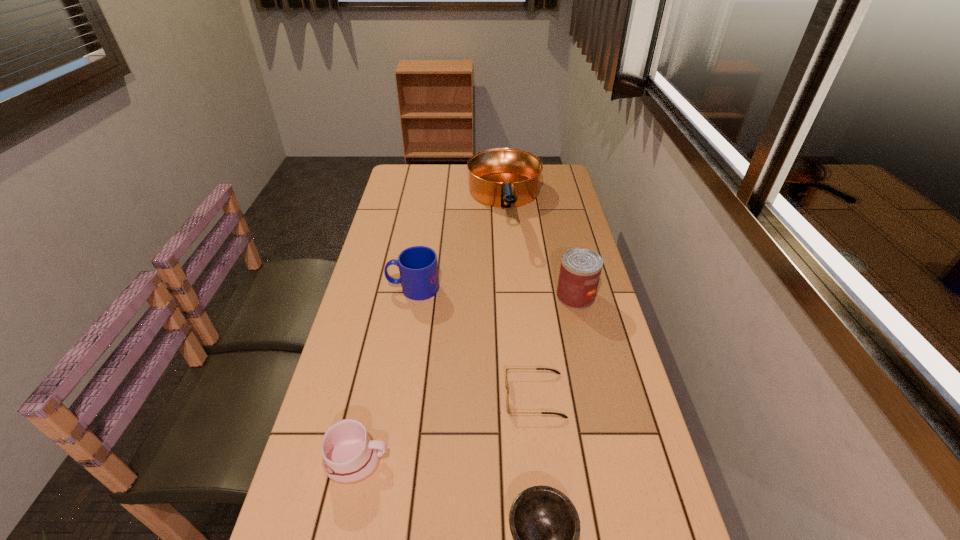
The height and width of the screenshot is (540, 960). I want to click on the farthest object, so click(501, 177).

At what (x,y) coordinates should I click in order to perform the action: click on frying pan. Please return your answer as a coordinate pair (x, y). Looking at the image, I should click on (501, 177).

At what (x,y) coordinates should I click in order to perform the action: click on can. Please return your answer as a coordinate pair (x, y). The height and width of the screenshot is (540, 960). Looking at the image, I should click on (580, 270).

The height and width of the screenshot is (540, 960). Find the location of `the farther mug`. the farther mug is located at coordinates (418, 267).

This screenshot has height=540, width=960. I want to click on the taller mug, so click(418, 267).

Locate an element on the screen. Image resolution: width=960 pixels, height=540 pixels. the nearer mug is located at coordinates (349, 455).

Find the location of a particular element. This screenshot has height=540, width=960. the second nearest object is located at coordinates (349, 455).

The height and width of the screenshot is (540, 960). Identify the location of the third nearest object. (557, 372).

Image resolution: width=960 pixels, height=540 pixels. I want to click on sunglasses, so click(x=557, y=372).

You are a GUI agent. You are given a task and a screenshot of the screen. Output one action in this format:
    pyautogui.click(x=<x>, y=<y>)
    Task: Click on the free space located 0.110m on the handle side of the frying pan
    This screenshot has width=960, height=540.
    Given the screenshot: What is the action you would take?
    pyautogui.click(x=510, y=265)